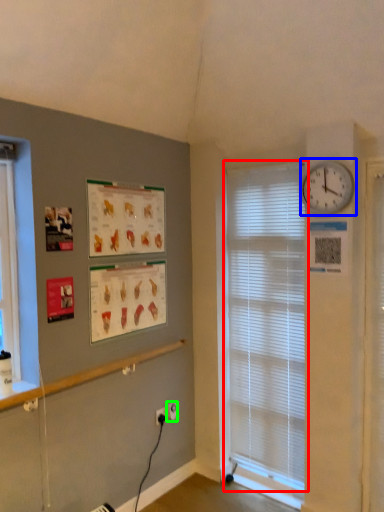
Question: Which object is positioned closest to window blind (highlighted by a red box)? Select from wall clock (highlighted by a blue box) and electric outlet (highlighted by a green box).

Choices:
 (A) wall clock
 (B) electric outlet

Answer: (A)